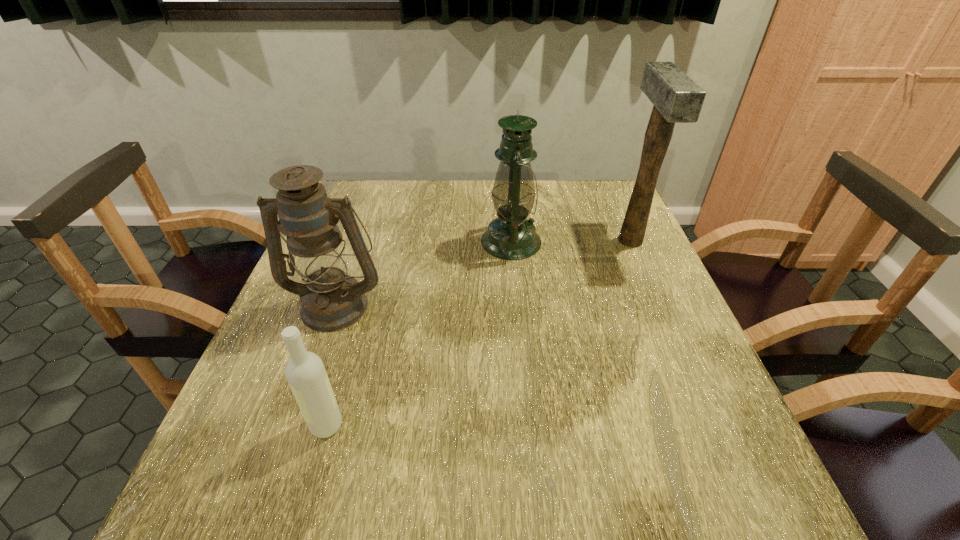
Find the location of a particular element. The height and width of the screenshot is (540, 960). free region located 0.400m on the back of the second nearest object is located at coordinates (374, 194).

Identify the location of free space located on the right of the nearest object. The width and height of the screenshot is (960, 540). (498, 425).

Locate an element on the screen. This screenshot has height=540, width=960. mallet at the far edge is located at coordinates pos(676,98).

At what (x,y) coordinates should I click in order to perform the action: click on oil lamp located at the far edge. Please return your answer as a coordinate pair (x, y). Looking at the image, I should click on (511, 236).

At what (x,y) coordinates should I click in order to perform the action: click on oil lamp positioned at the left edge. Please return your answer as a coordinate pair (x, y). Looking at the image, I should click on (331, 300).

The image size is (960, 540). I want to click on vodka located in the left edge section of the desktop, so click(x=305, y=372).

Identify the location of object present at the right edge. (676, 98).

This screenshot has width=960, height=540. Find the location of `object situated at the far right corner`. object situated at the far right corner is located at coordinates [676, 98].

In the image, there is a desktop. Identify the location of vacant space at the far edge. (473, 193).

Where is `blank space at the near edge of the desktop`? The width and height of the screenshot is (960, 540). blank space at the near edge of the desktop is located at coordinates (585, 470).